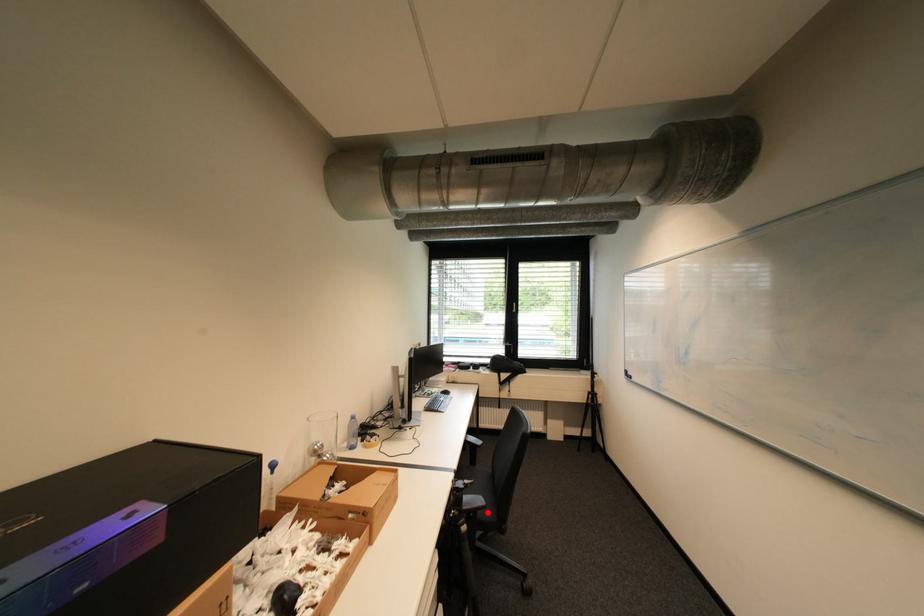
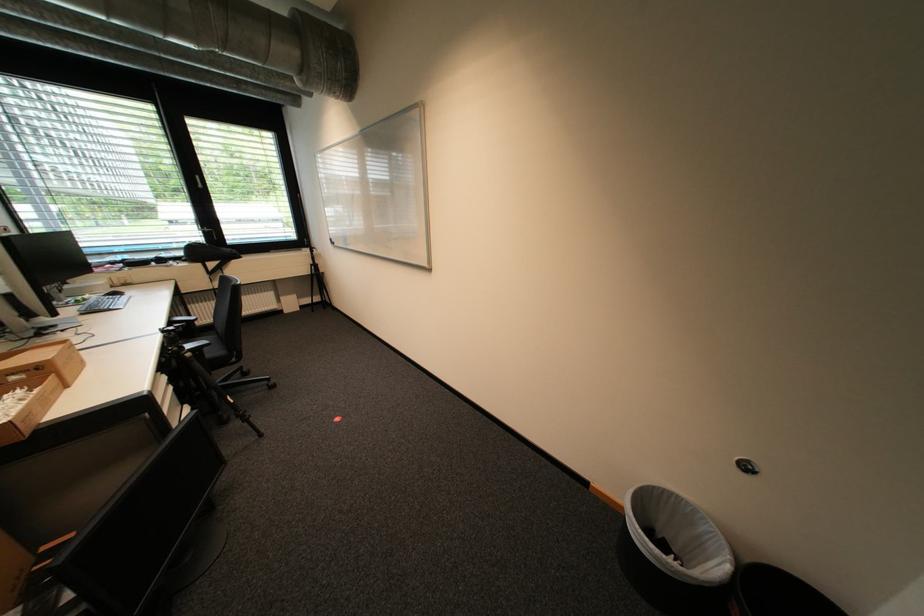
Where in the second image is the point corresponding to the highlighted location from the first image?

(213, 350)